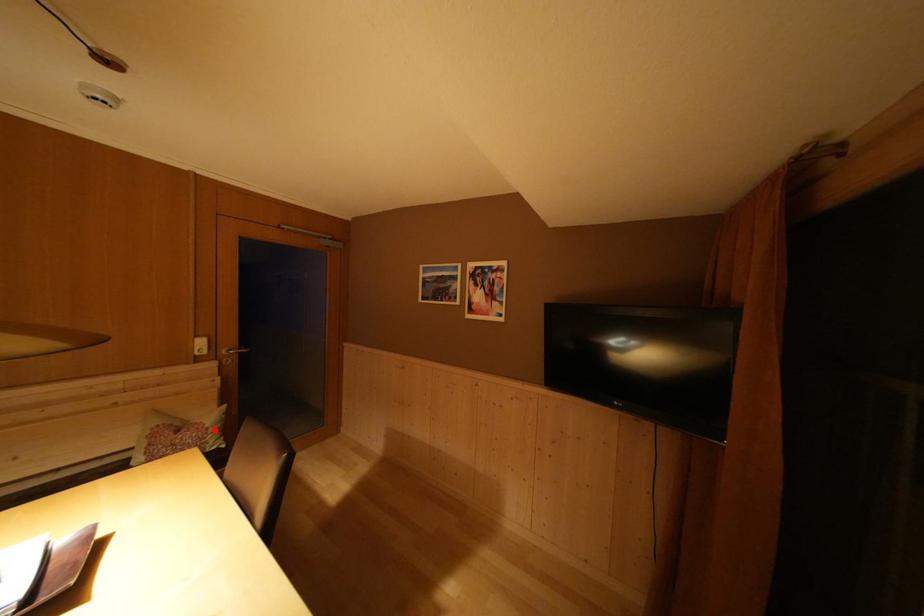
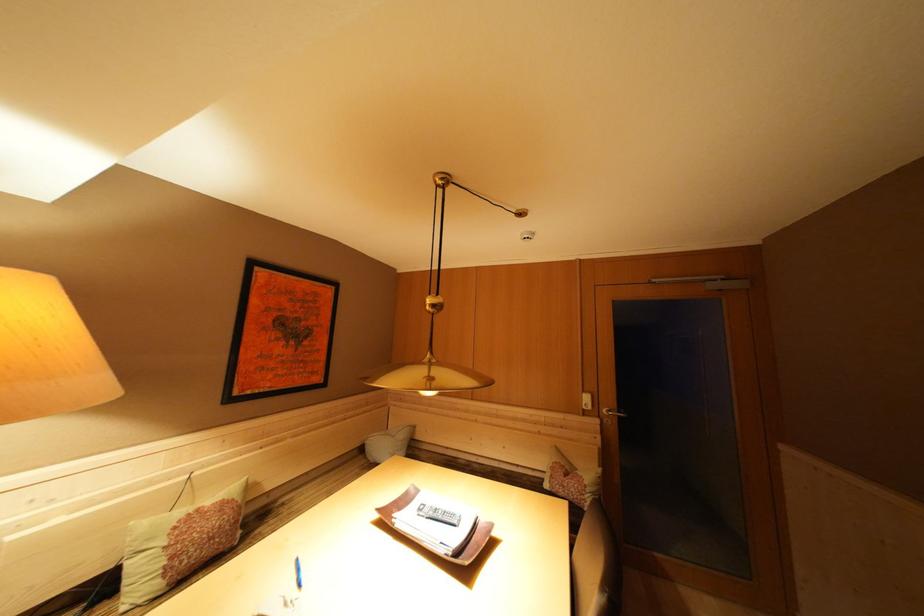
The point at the highlighted location is marked in the first image. Where is the corresponding point in the second image?

(592, 487)